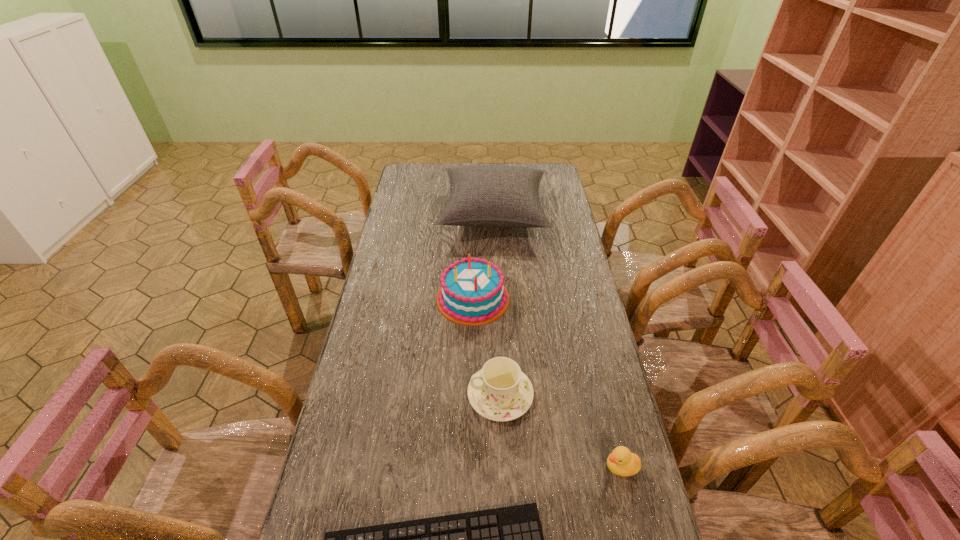
At what (x,y) coordinates should I click in order to perform the action: click on free space at the far edge. Please return your answer as a coordinate pair (x, y). Looking at the image, I should click on click(436, 177).

Where is `free space at the left edge of the desktop`? This screenshot has width=960, height=540. free space at the left edge of the desktop is located at coordinates click(405, 294).

The width and height of the screenshot is (960, 540). What are the coordinates of `free location at the right edge of the desktop` in the screenshot? It's located at (566, 426).

Locate an element on the screen. This screenshot has width=960, height=540. free space between the rightmost object and the second farthest object is located at coordinates (547, 383).

Find the location of a particular element. The image size is (960, 540). free space between the tallest object and the fourth farthest object is located at coordinates (557, 340).

This screenshot has height=540, width=960. In order to click on free space between the second nearest object and the cushion in this screenshot , I will do `click(557, 340)`.

I want to click on unoccupied area between the duckling and the third tallest object, so click(561, 431).

The image size is (960, 540). In order to click on vacant area that lies between the fourth nearest object and the duckling in this screenshot , I will do `click(547, 383)`.

Image resolution: width=960 pixels, height=540 pixels. I want to click on the closest object to the second shortest object, so click(527, 515).

Identify which object is the closest to the third shortest object. Please provide its 2D coordinates. Your answer should be formatted as a tuple, i.e. [(x, y)], where the tuple contains the x and y coordinates of a point satisfying the conditions above.

[(473, 292)]